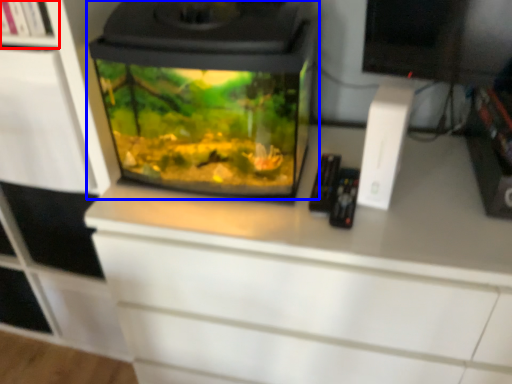
Question: Which point is further to the camera, shelf (highlighted by a red box) or home appliance (highlighted by a blue box)?

Choices:
 (A) shelf
 (B) home appliance

Answer: (A)